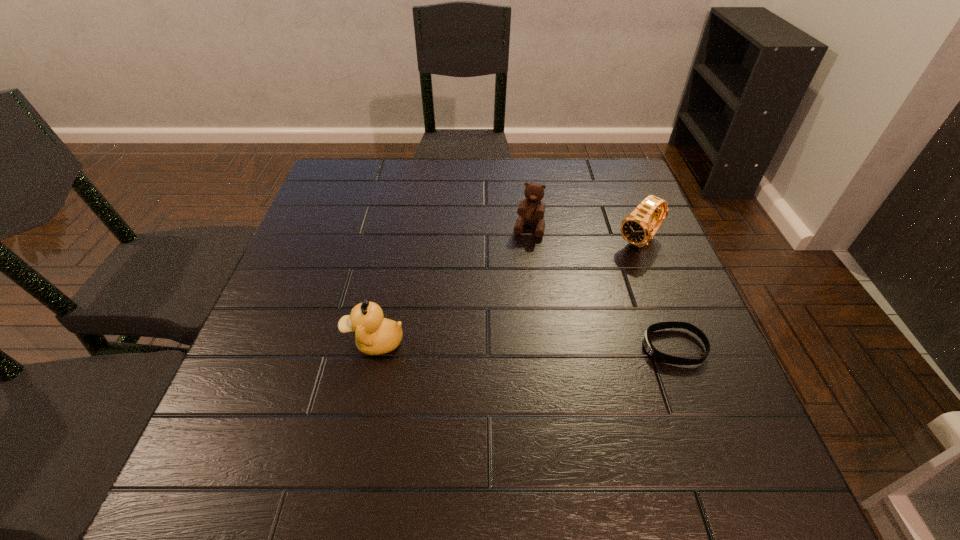
The image size is (960, 540). Identify the location of free region located on the face of the second object from left to right. (505, 308).

Find the location of a particular element. The width and height of the screenshot is (960, 540). free point located on the face of the second object from left to right is located at coordinates (498, 334).

Where is `free location located on the face of the second object from left to right`? free location located on the face of the second object from left to right is located at coordinates (510, 292).

Locate an element on the screen. The width and height of the screenshot is (960, 540). blank area located 0.140m on the face of the watch is located at coordinates (591, 282).

Image resolution: width=960 pixels, height=540 pixels. In order to click on free space located 0.250m on the face of the watch in this screenshot , I will do (x=562, y=308).

The width and height of the screenshot is (960, 540). I want to click on vacant space located 0.240m on the face of the watch, so click(x=564, y=306).

Identify the location of wristband present at the right edge. point(651,350).

Identify the location of watch that is at the right edge. Image resolution: width=960 pixels, height=540 pixels. (637, 228).

The image size is (960, 540). In order to click on free space at the far edge of the desktop in this screenshot , I will do `click(525, 174)`.

You are a GUI agent. You are given a task and a screenshot of the screen. Output one action in this format:
    pyautogui.click(x=<x>, y=<y>)
    Task: Click on the free space at the near edge of the desktop
    The width and height of the screenshot is (960, 540).
    Given the screenshot: What is the action you would take?
    pyautogui.click(x=321, y=422)